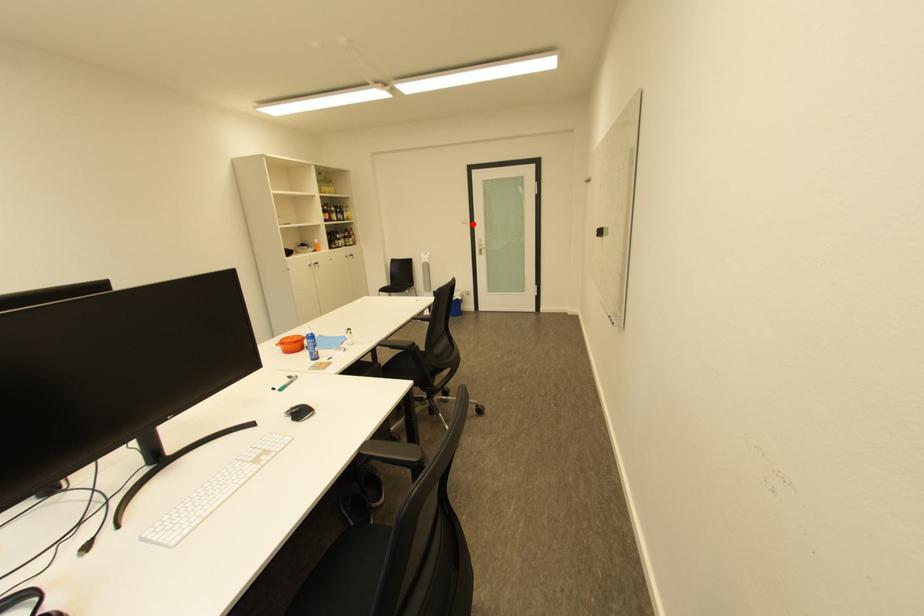
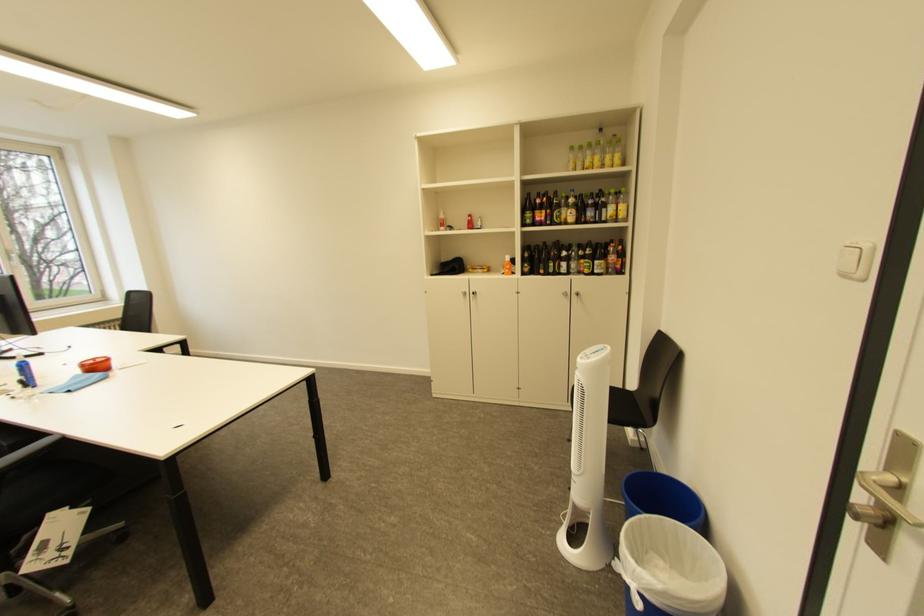
Question: I am providing you with two images of the same scene from different viewpoints. Image1 has a red point marked. In image2, the corresponding 3D location appears at what relative position? Reply with the corresponding letter.

Choices:
 (A) Closer
 (B) Farther

Answer: (B)